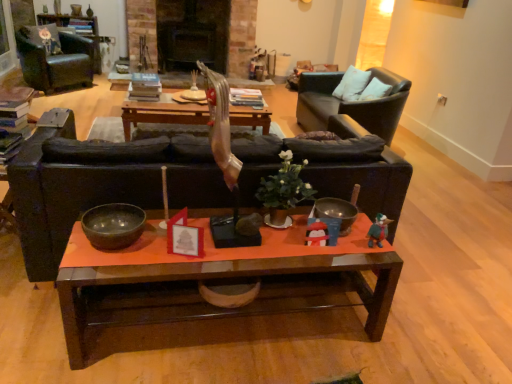
Question: Which direction should I rotate to look at wooden coffee table at center, which ranks as the 1th coffee table in back-to-front order?

Choices:
 (A) left
 (B) right

Answer: (A)

Question: Is plush green duck at right completely or partially outside of velvet floral pillow at upper left, acting as the first pillow starting from the left?

Choices:
 (A) yes
 (B) no

Answer: (A)

Question: Would you say plush green duck at right is a long distance from velvet floral pillow at upper left, the 2th pillow when ordered from right to left?

Choices:
 (A) no
 (B) yes

Answer: (B)

Question: Is plush green duck at right closer to camera compared to velvet floral pillow at upper left, which is the 2th pillow in front-to-back order?

Choices:
 (A) yes
 (B) no

Answer: (A)

Question: Is plush green duck at right oriented away from velvet floral pillow at upper left, which is the 2th pillow in front-to-back order?

Choices:
 (A) yes
 (B) no

Answer: (B)

Question: Is plush green duck at right to the right of velvet floral pillow at upper left, acting as the first pillow starting from the left, from the viewer's perspective?

Choices:
 (A) no
 (B) yes

Answer: (B)

Question: Can you confirm if plush green duck at right is thinner than velvet floral pillow at upper left, the 2th pillow when ordered from right to left?

Choices:
 (A) yes
 (B) no

Answer: (A)

Question: Is black leather chair at upper right, acting as the first chair starting from the right, taller than velvet floral pillow at upper left, which ranks as the 2th pillow in bottom-to-top order?

Choices:
 (A) yes
 (B) no

Answer: (A)

Question: Is black leather chair at upper right, which is the second chair from left to right, not inside velvet floral pillow at upper left, which ranks as the 2th pillow in bottom-to-top order?

Choices:
 (A) no
 (B) yes

Answer: (B)

Question: Considering the relative sizes of black leather chair at upper right, which is the second chair from left to right, and velvet floral pillow at upper left, which ranks as the 2th pillow in bottom-to-top order, in the image provided, is black leather chair at upper right, which is the second chair from left to right, wider than velvet floral pillow at upper left, which ranks as the 2th pillow in bottom-to-top order,?

Choices:
 (A) yes
 (B) no

Answer: (A)

Question: From the image's perspective, does black leather chair at upper right, which is the second chair from left to right, appear higher than velvet floral pillow at upper left, the 2th pillow when ordered from right to left?

Choices:
 (A) yes
 (B) no

Answer: (B)

Question: From a real-world perspective, is black leather chair at upper right, acting as the first chair starting from the right, on top of velvet floral pillow at upper left, which ranks as the 2th pillow in bottom-to-top order?

Choices:
 (A) yes
 (B) no

Answer: (B)

Question: Is black leather chair at upper right, which is the second chair from left to right, oriented away from velvet floral pillow at upper left, which is the 2th pillow in front-to-back order?

Choices:
 (A) yes
 (B) no

Answer: (B)

Question: Is white soft pillow at upper right, positioned as the 1th pillow in right-to-left order, to the left of plush green duck at right from the viewer's perspective?

Choices:
 (A) no
 (B) yes

Answer: (A)